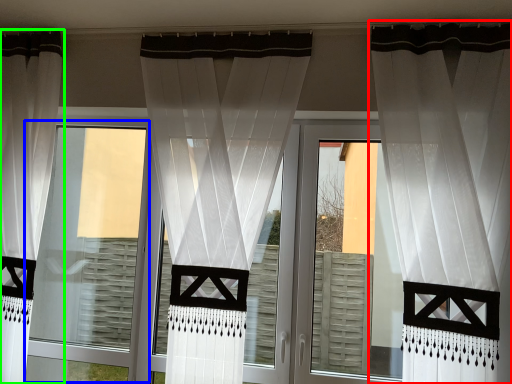
Question: Estimate the real-world distances between objects in this image. Which object is closer to curtain (highlighted by a red box), window frame (highlighted by a blue box) or curtain (highlighted by a green box)?

Choices:
 (A) window frame
 (B) curtain

Answer: (A)